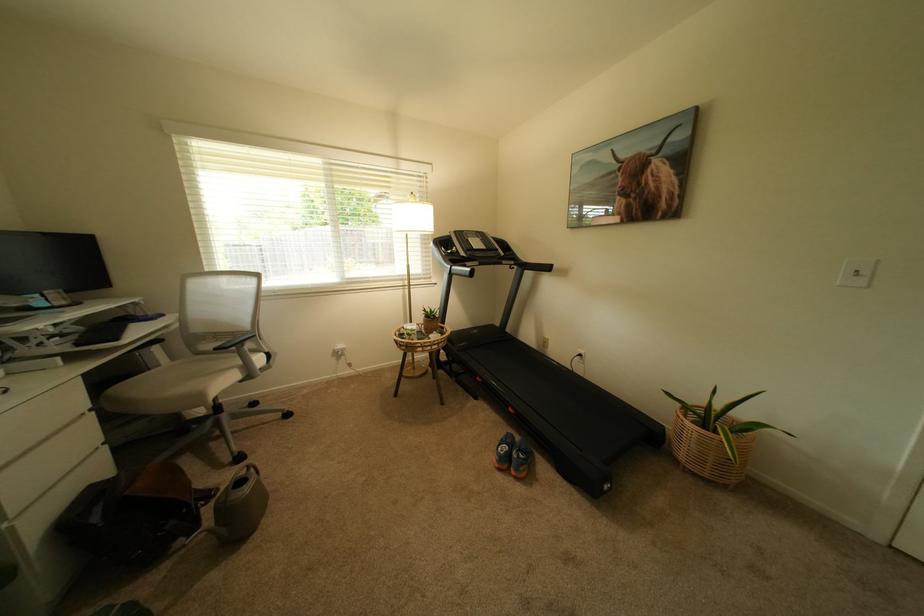
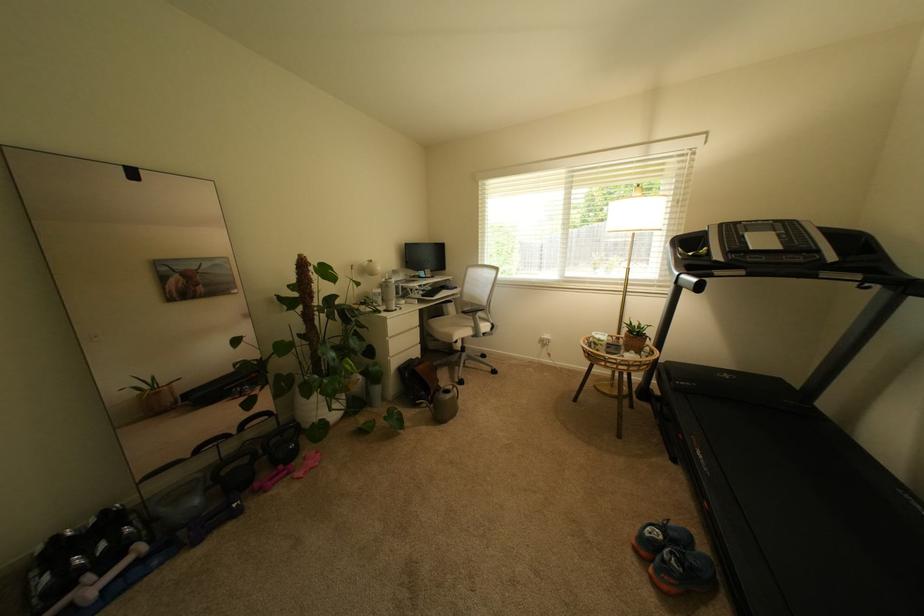
The point at (524, 458) is marked in the first image. Where is the corresponding point in the second image?

(674, 557)